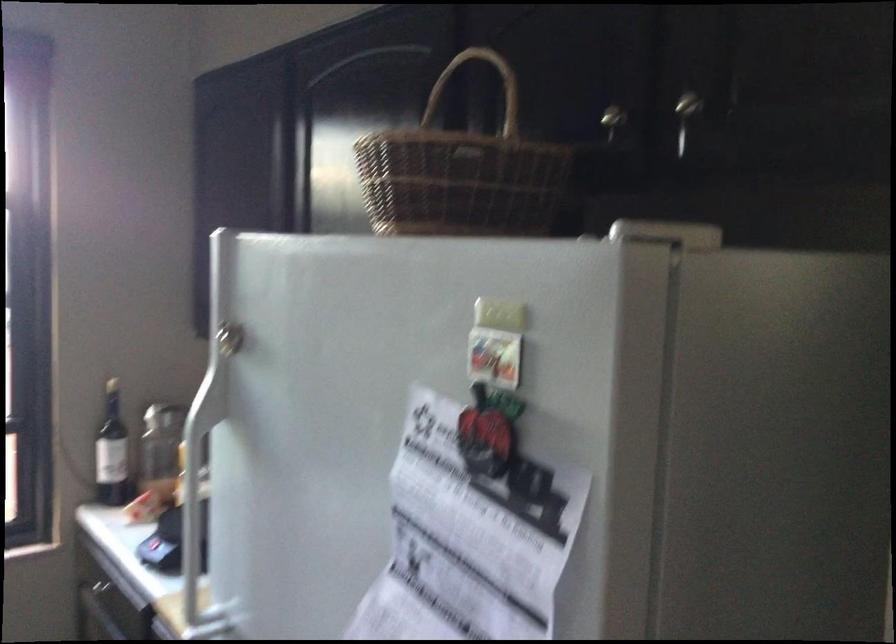
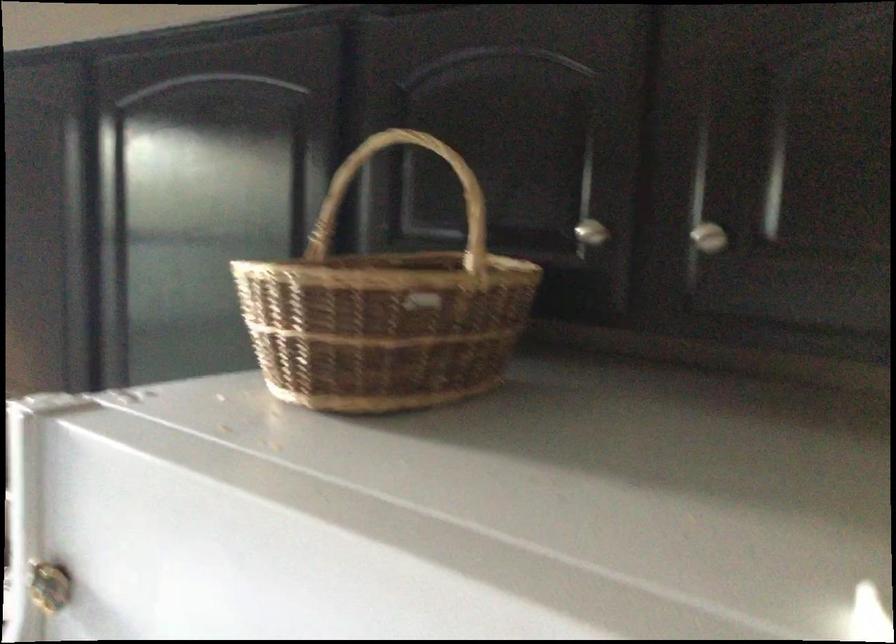
Locate, in the second image, the point that corresponds to point 609,109 in the first image.

(590, 232)